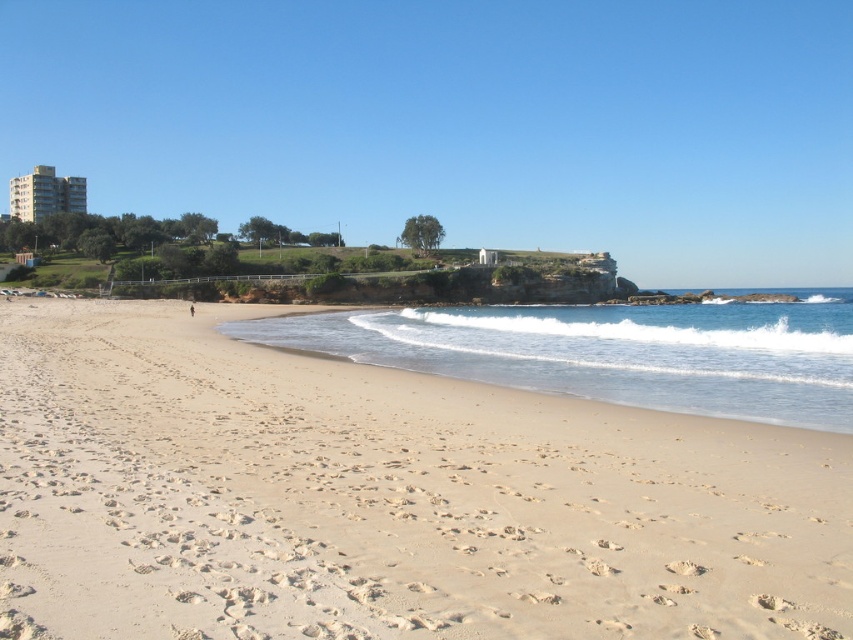
You are a beachgoer standing at the light beige sand at lower center and want to reach the clear blue water at lower right. Which surface will you encounter first as you walk towards the water?

The light beige sand at lower center has a smaller size compared to clear blue water at lower right, so you will encounter the light beige sand at lower center first as you walk towards the water.

You are planning to build a sandcastle on the light beige sand at lower center. Considering the clear blue water at lower right is nearby, will the sandcastle be at risk of being washed away by the water?

The light beige sand at lower center is thinner than the clear blue water at lower right, which means the water might reach the sandcastle more easily. Therefore, the sandcastle could be at risk of being washed away by the water.